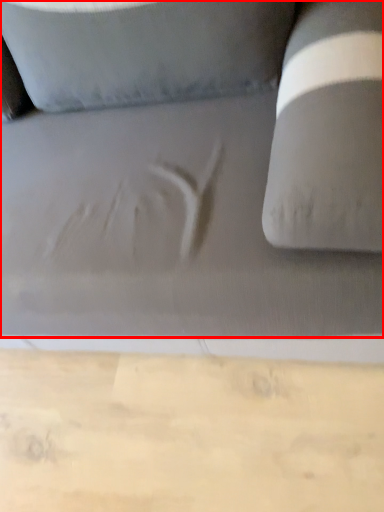
Question: From the image's perspective, where is studio couch (annotated by the red box) located relative to cardboard?

Choices:
 (A) below
 (B) above

Answer: (B)